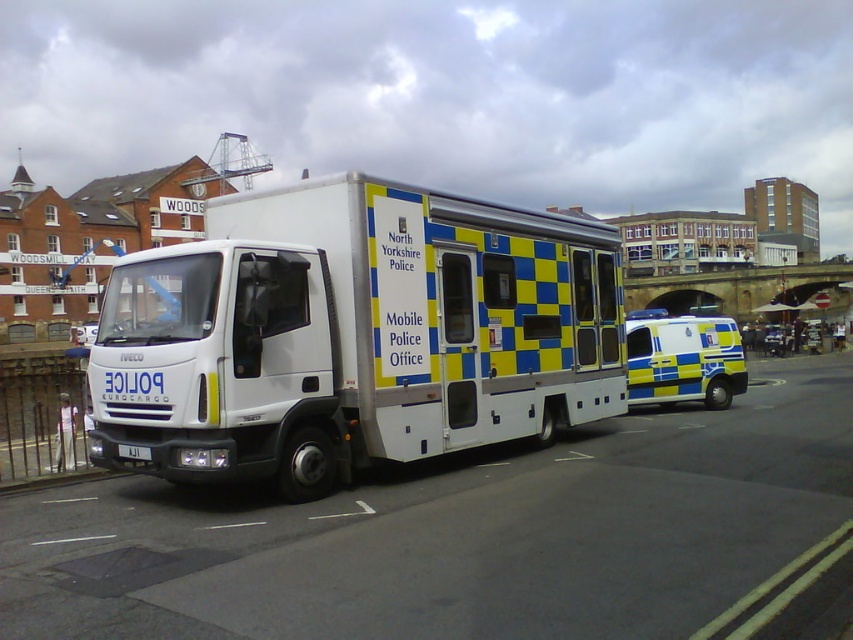
Question: Does white glossy mobile police office at center appear on the left side of yellow and blue checkered ambulance at center?

Choices:
 (A) yes
 (B) no

Answer: (A)

Question: Can you confirm if white glossy mobile police office at center is bigger than white plastic license plate at center?

Choices:
 (A) yes
 (B) no

Answer: (A)

Question: Is white glossy mobile police office at center further to camera compared to yellow and blue checkered ambulance at center?

Choices:
 (A) yes
 (B) no

Answer: (B)

Question: Which of the following is the closest to the observer?

Choices:
 (A) yellow and blue checkered ambulance at center
 (B) white glossy mobile police office at center
 (C) white plastic license plate at center

Answer: (B)

Question: Which of the following is the closest to the observer?

Choices:
 (A) (722, 362)
 (B) (473, 305)
 (C) (117, 451)

Answer: (C)

Question: Which of these objects is positioned closest to the yellow and blue checkered ambulance at center?

Choices:
 (A) white plastic license plate at center
 (B) white glossy mobile police office at center

Answer: (B)